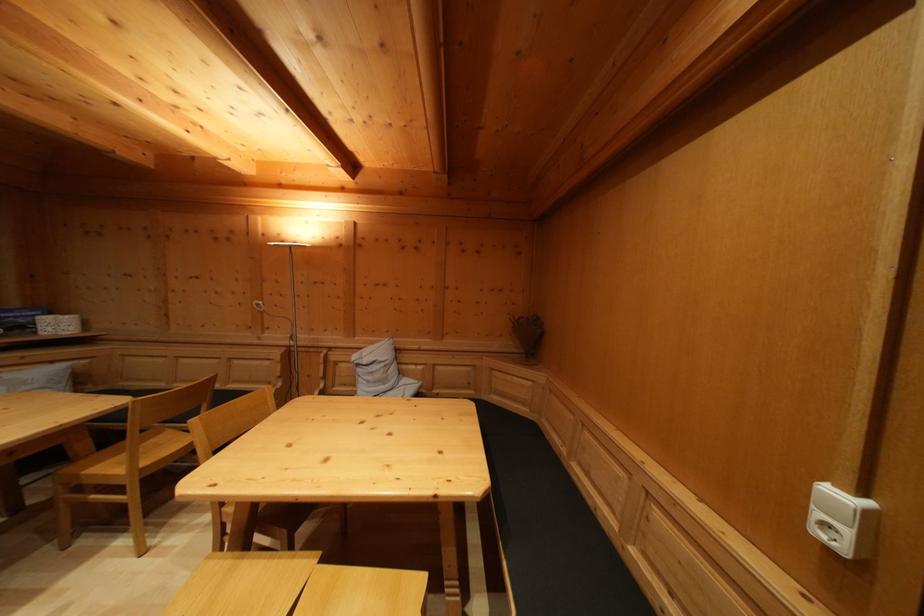
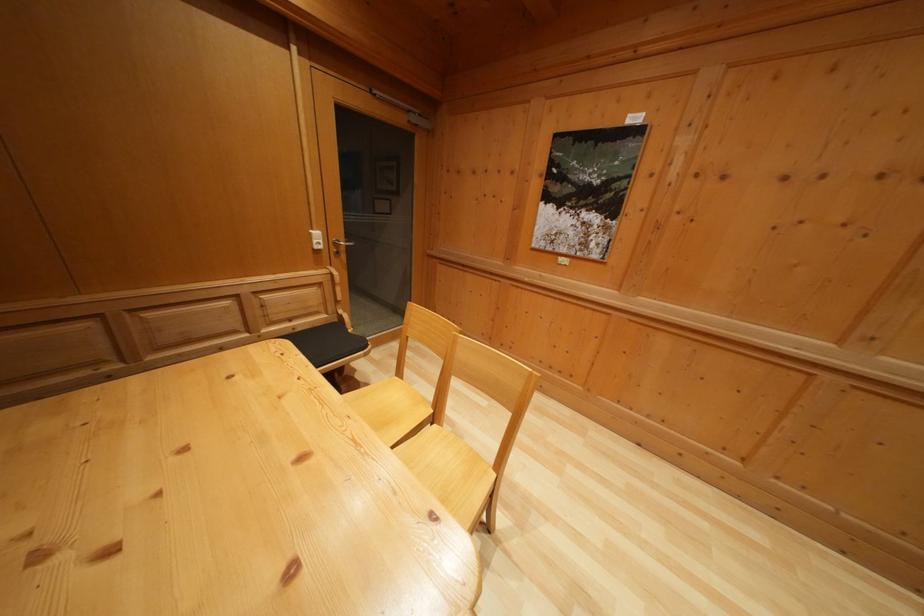
Locate, in the second image, the point that corresponds to point 845,504 in the first image.

(322, 240)